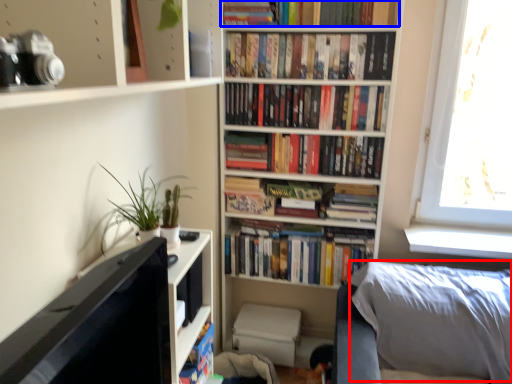
Question: Which object appears farthest to the camera in this image, pillow (highlighted by a red box) or book (highlighted by a blue box)?

Choices:
 (A) pillow
 (B) book

Answer: (B)